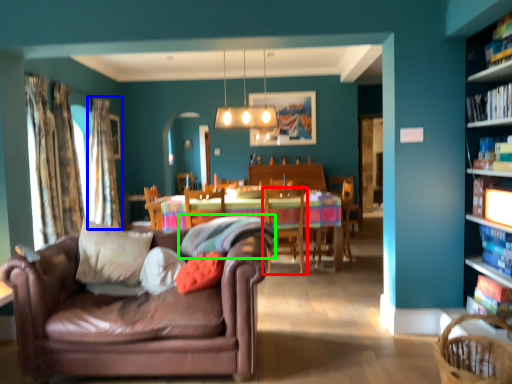
Question: Based on their relative distances, which object is farther from chair (highlighted by a red box)? Choose from curtain (highlighted by a blue box) and pillow (highlighted by a green box).

Choices:
 (A) curtain
 (B) pillow

Answer: (A)